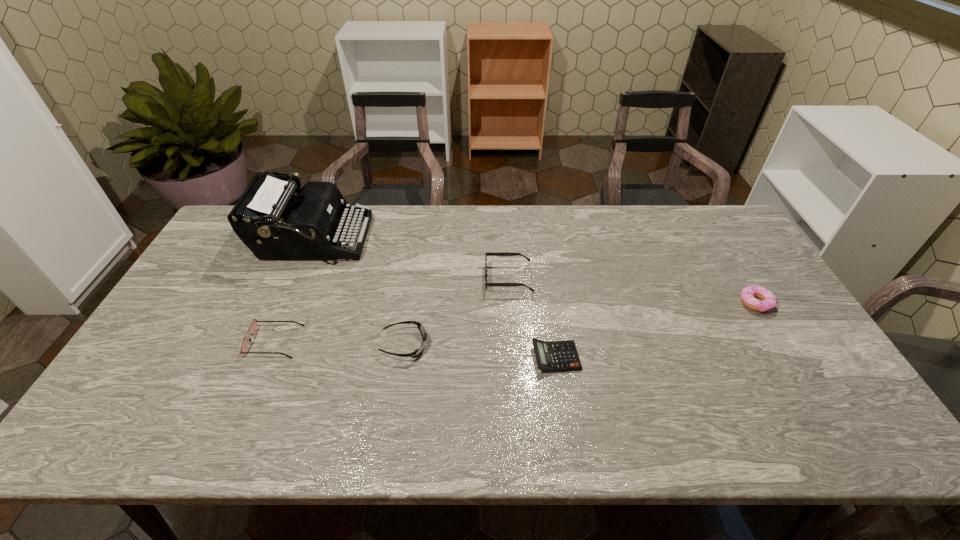
The image size is (960, 540). Find the location of `vacant area at the far edge of the desktop`. vacant area at the far edge of the desktop is located at coordinates (648, 217).

Locate an element on the screen. free region at the near edge is located at coordinates (648, 441).

Identify the location of vacant region at the left edge of the desktop. (163, 377).

In order to click on vacant region at the right edge of the desktop in this screenshot , I will do `click(799, 371)`.

Where is `free point at the near left corner`? The width and height of the screenshot is (960, 540). free point at the near left corner is located at coordinates (131, 411).

The width and height of the screenshot is (960, 540). Identify the location of free spot between the typewriter and the rightmost object. (534, 271).

Locate an element on the screen. The width and height of the screenshot is (960, 540). vacant area that lies between the leftmost sunglasses and the doughnut is located at coordinates (515, 322).

Where is `empty space between the leftmost sunglasses and the shortest sunglasses`? empty space between the leftmost sunglasses and the shortest sunglasses is located at coordinates (339, 343).

Where is `vacant space that's between the tallest object and the leftmost sunglasses`? Image resolution: width=960 pixels, height=540 pixels. vacant space that's between the tallest object and the leftmost sunglasses is located at coordinates (294, 291).

At what (x,y) coordinates should I click in order to perform the action: click on vacant area between the rightmost object and the shortest object. Please return your answer as a coordinate pair (x, y). This screenshot has width=960, height=540. Looking at the image, I should click on (656, 330).